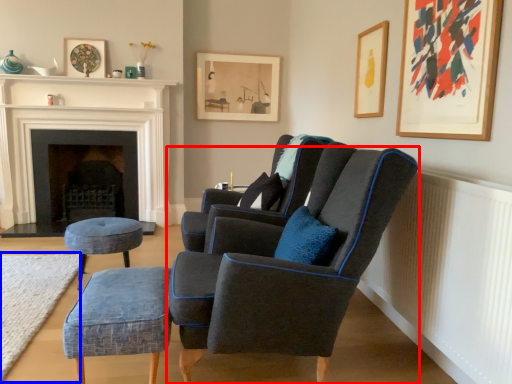
Question: Which object appears farthest to the camera in this image, chair (highlighted by a red box) or plain (highlighted by a blue box)?

Choices:
 (A) chair
 (B) plain

Answer: (B)